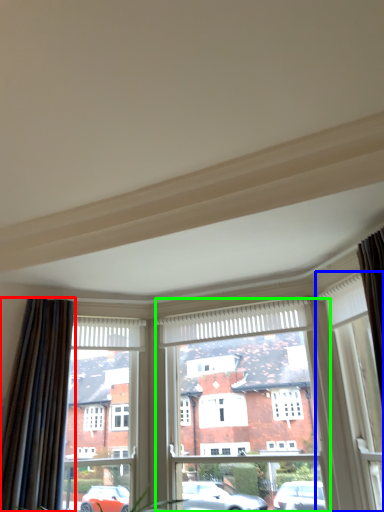
Question: Which is farther away from curtain (highlighted by a red box)? window (highlighted by a blue box) or window frame (highlighted by a green box)?

Choices:
 (A) window
 (B) window frame

Answer: (A)